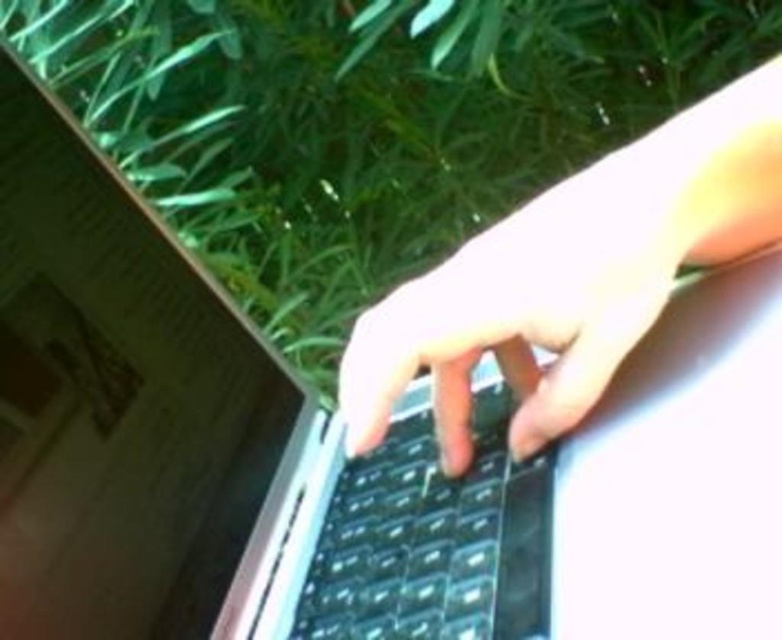
In the scene shown: You are a photographer trying to capture a close detail of the black plastic keyboard at center. You notice the satin black hand at center is blocking your view. Can you move the hand to get a clear shot of the keyboard?

The satin black hand at center is further to the viewer than black plastic keyboard at center, so moving the hand away from the camera would allow you to see the keyboard clearly.

You are trying to reach the satin black hand at center without touching the sleek silver laptop at center. Based on their positions, can you move your hand to the right side of the laptop?

The sleek silver laptop at center is to the left of the satin black hand at center, so moving your hand to the right side of the laptop would avoid touching it.